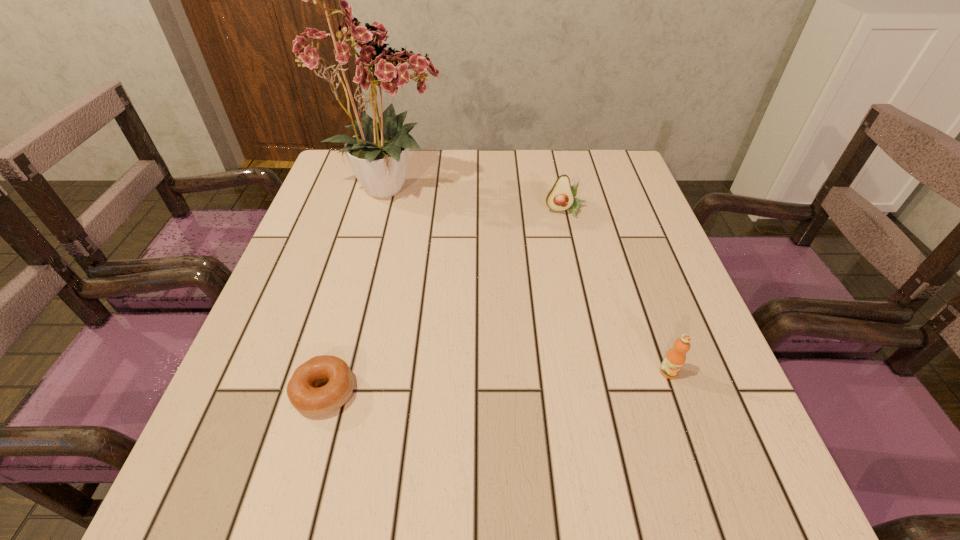
At what (x,y) coordinates should I click in order to perform the action: click on free spot between the orange juice and the bagel. Please return your answer as a coordinate pair (x, y). Image resolution: width=960 pixels, height=540 pixels. Looking at the image, I should click on (496, 382).

Point out which object is positioned as the nearest to the avocado. Please provide its 2D coordinates. Your answer should be formatted as a tuple, i.e. [(x, y)], where the tuple contains the x and y coordinates of a point satisfying the conditions above.

[(378, 154)]

Where is `object that is the third closest to the orange juice`? This screenshot has width=960, height=540. object that is the third closest to the orange juice is located at coordinates (378, 154).